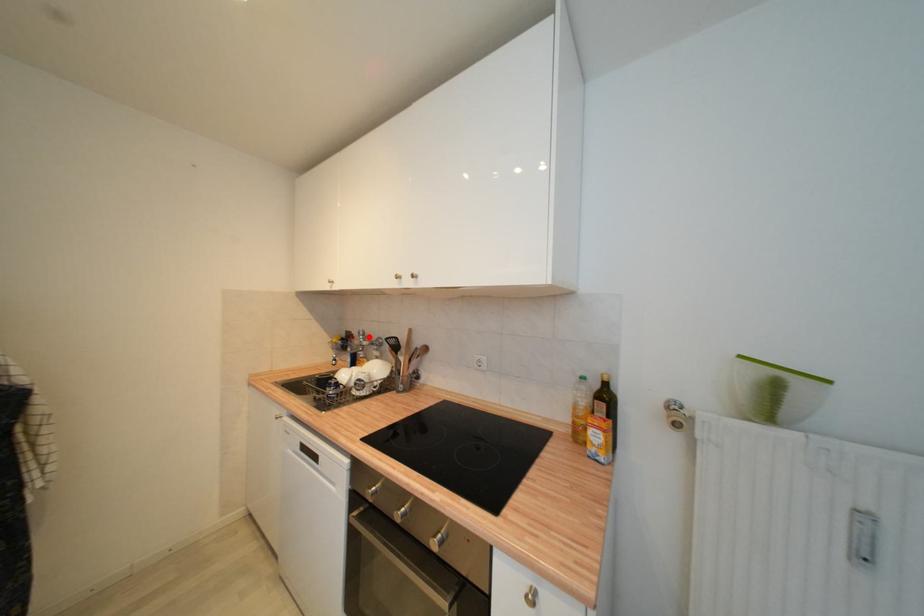
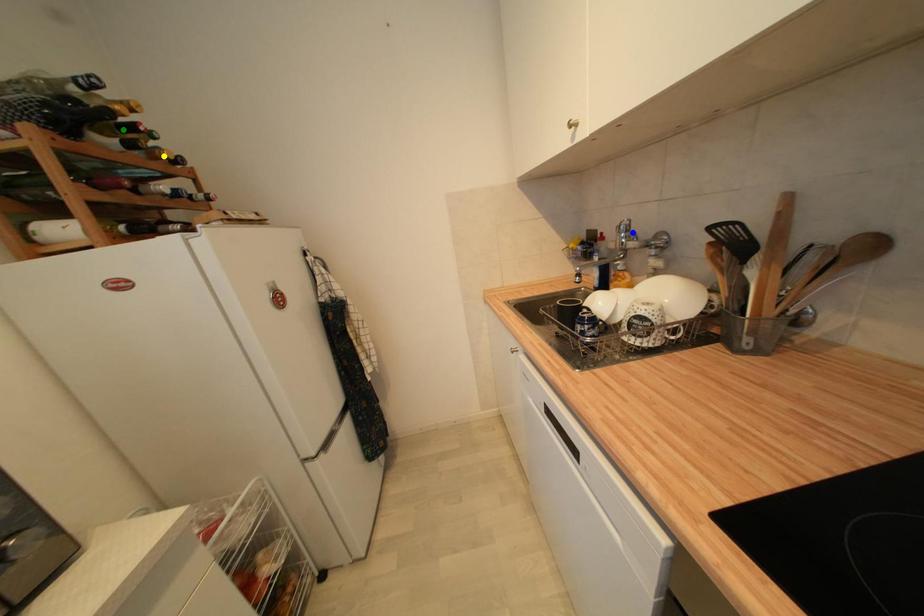
Question: I am providing you with two images of the same scene from different viewpoints. A red point is marked on the first image. You are given multiple points on the second image. Which point in image 2 is actually the same real-world point as the red point in image 1?

Choices:
 (A) blue point
 (B) green point
 (C) yellow point

Answer: (A)